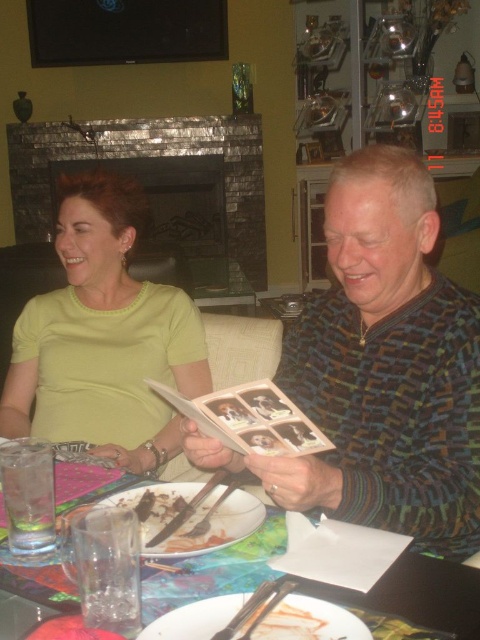
Question: Does multicolored sweater at center appear over dark brown cake at lower center?

Choices:
 (A) yes
 (B) no

Answer: (A)

Question: Which of the following is the farthest from the observer?

Choices:
 (A) (421, 262)
 (B) (57, 358)

Answer: (B)

Question: Which of the following is the closest to the observer?

Choices:
 (A) multicolored sweater at center
 (B) dark brown cake at lower center
 (C) lime green shirt at center

Answer: (B)

Question: Can you confirm if lime green shirt at center is wider than beige paper book at center?

Choices:
 (A) yes
 (B) no

Answer: (A)

Question: Is the position of lime green shirt at center more distant than that of plastic table at center?

Choices:
 (A) yes
 (B) no

Answer: (A)

Question: Which point is farther to the camera?

Choices:
 (A) multicolored sweater at center
 (B) dark brown cake at lower center
 (C) plastic table at center

Answer: (A)